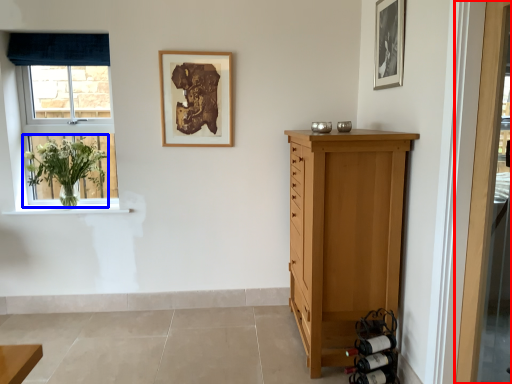
Question: Which object is closer to the camera taking this photo, door (highlighted by a red box) or floral arrangement (highlighted by a blue box)?

Choices:
 (A) door
 (B) floral arrangement

Answer: (A)